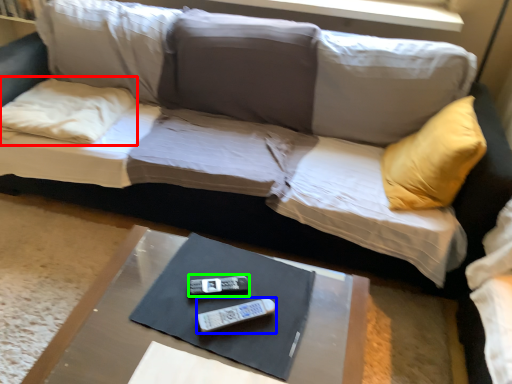
Question: Which object is the closest to the pillow (highlighted by a red box)? Choose among these: remote (highlighted by a blue box) or remote (highlighted by a green box).

Choices:
 (A) remote
 (B) remote

Answer: (B)